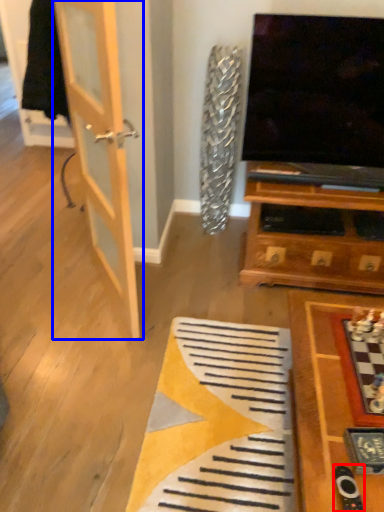
Question: Among these objects, which one is nearest to the camera, remote (highlighted by a red box) or door (highlighted by a blue box)?

Choices:
 (A) remote
 (B) door

Answer: (A)